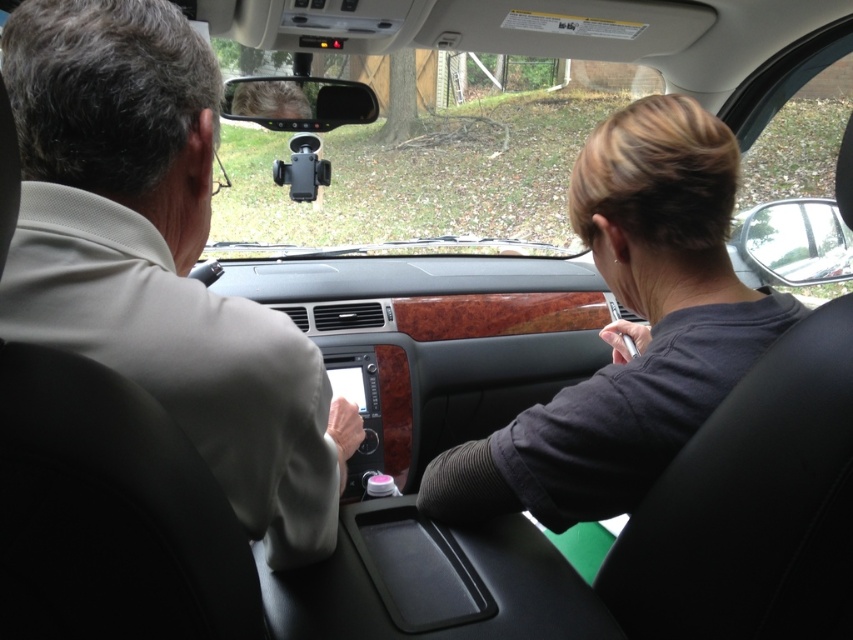
You are a passenger in the car and need to determine if the light beige suit at left can fit into the narrow space between the clear plastic view mirror at upper center and the window. Can it fit?

The light beige suit at left is thinner than the clear plastic view mirror at upper center, so it can fit into the narrow space between them.

You are sitting in the backseat of the car and need to reach a point that is behind another point. Which of the two points, point (817, 230) or point (328, 118), is located behind the other?

Point (817, 230) is behind point (328, 118).

You are a passenger in the car and want to check the light beige suit at left without moving your head. Can you see it by looking up at the clear plastic view mirror at upper center?

The light beige suit at left is positioned under the clear plastic view mirror at upper center, so you can see it by looking up at the clear plastic view mirror at upper center.